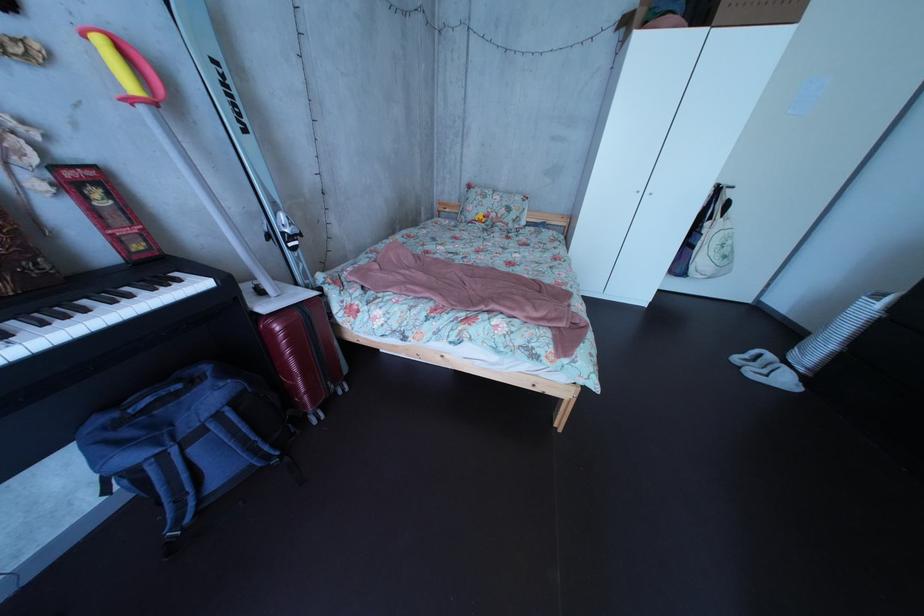
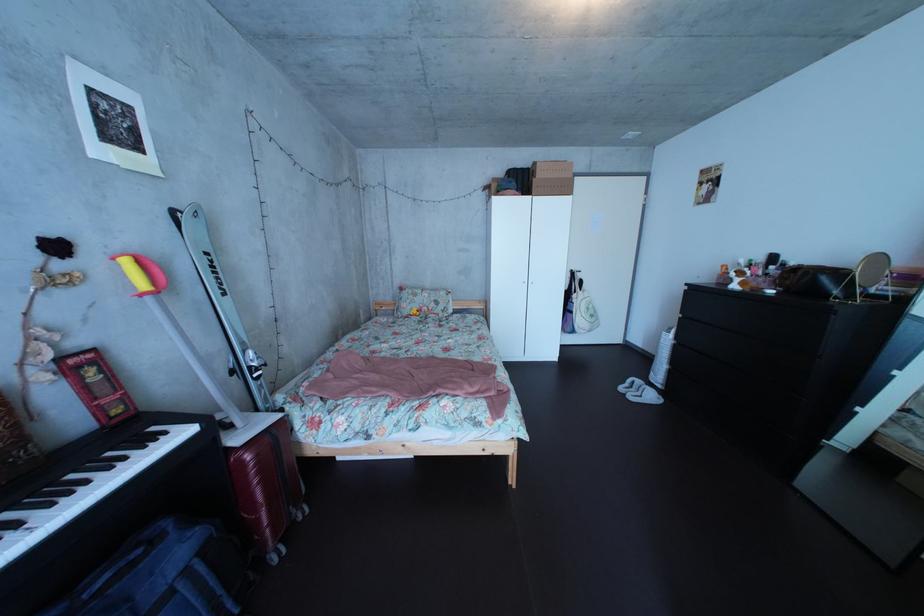
Based on the continuous images, in which direction is the camera rotating?

The camera's rotation is toward right-up.